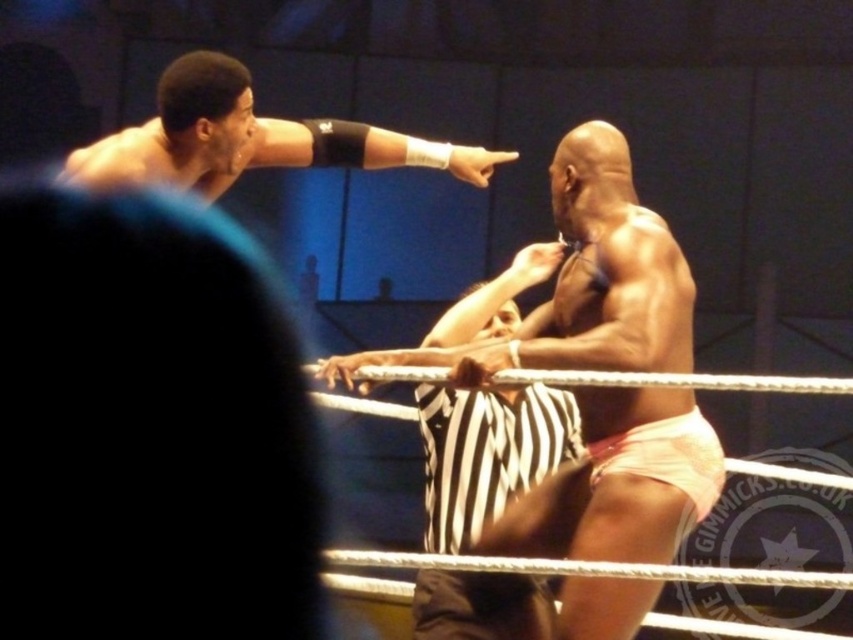
Who is positioned more to the right, pink fabric shorts at center or matte black arm at upper left?

Positioned to the right is pink fabric shorts at center.

Looking at this image, can you confirm if pink fabric shorts at center is positioned below matte black arm at upper left?

Yes.

At what (x,y) coordinates should I click in order to perform the action: click on pink fabric shorts at center. Please return your answer as a coordinate pair (x, y). Looking at the image, I should click on (584, 282).

Image resolution: width=853 pixels, height=640 pixels. In order to click on pink fabric shorts at center in this screenshot , I will do `click(584, 282)`.